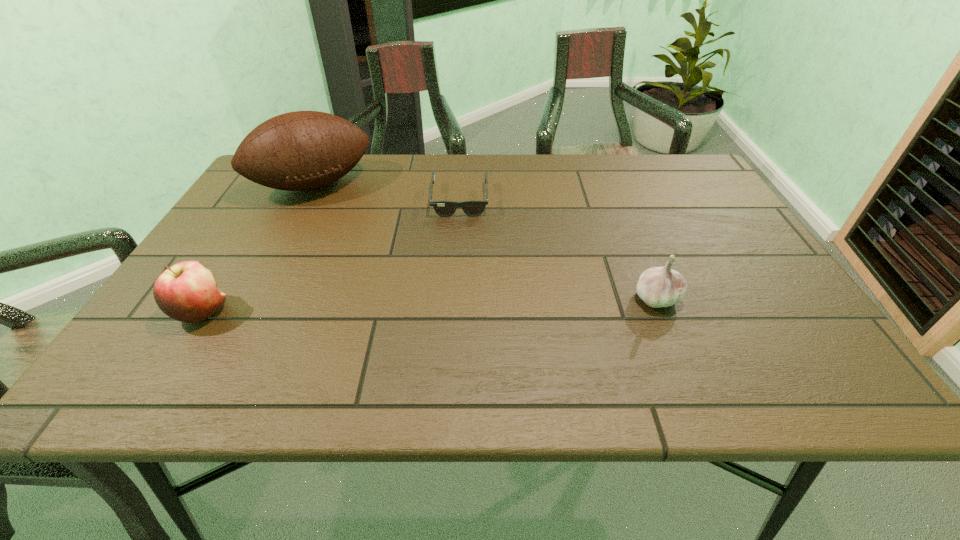
In order to click on vacant space positioned on the laces of the football in this screenshot , I will do `click(358, 251)`.

This screenshot has width=960, height=540. Find the location of `vacant space located 0.200m on the laces of the football`. vacant space located 0.200m on the laces of the football is located at coordinates 355,246.

This screenshot has width=960, height=540. What are the coordinates of `vacant region located 0.200m on the laces of the football` in the screenshot? It's located at (355, 246).

Identify the location of sunglasses present at the far edge. point(473,207).

The width and height of the screenshot is (960, 540). Find the location of `football at the far edge`. football at the far edge is located at coordinates (302, 150).

Locate an element on the screen. object that is at the near edge is located at coordinates (187, 292).

At what (x,y) coordinates should I click in order to perform the action: click on apple that is positioned at the left edge. Please return your answer as a coordinate pair (x, y). Looking at the image, I should click on (187, 292).

The height and width of the screenshot is (540, 960). In order to click on football that is at the left edge in this screenshot , I will do `click(302, 150)`.

Find the location of `object at the far left corner`. object at the far left corner is located at coordinates coord(302,150).

I want to click on object situated at the near left corner, so click(x=187, y=292).